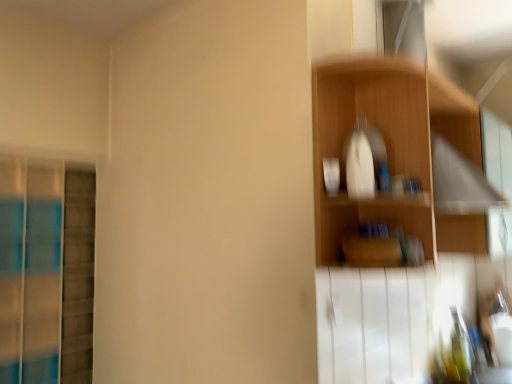
Describe the element at coordinates (391, 150) in the screenshot. I see `wooden shelf at upper right` at that location.

You are a GUI agent. You are given a task and a screenshot of the screen. Output one action in this format:
    pyautogui.click(x=<x>, y=<y>)
    Task: Click on the wooden shelf at upper right
    
    Given the screenshot: What is the action you would take?
    pyautogui.click(x=391, y=150)

In order to face wooden shelf at upper right, should I rotate leftwards or rightwards?

Turn right by 15.878 degrees to look at wooden shelf at upper right.

What is the approximate height of blue glass screen door at left?

It is 1.28 meters.

You are a GUI agent. You are given a task and a screenshot of the screen. Output one action in this format:
    pyautogui.click(x=<x>, y=<y>)
    Task: Click on the blue glass screen door at left
    The width and height of the screenshot is (512, 384).
    Given the screenshot: What is the action you would take?
    pyautogui.click(x=30, y=271)

Describe the element at coordinates (30, 271) in the screenshot. I see `blue glass screen door at left` at that location.

Where is `wooden shelf at upper right`? wooden shelf at upper right is located at coordinates (391, 150).

Which object is positioned more to the right, blue glass screen door at left or wooden shelf at upper right?

wooden shelf at upper right is more to the right.

Is blue glass screen door at left in front of wooden shelf at upper right?

No, it is behind wooden shelf at upper right.

Is point (51, 258) more distant than point (475, 246)?

Yes.

Looking at this image, from the image's perspective, is blue glass screen door at left located beneath wooden shelf at upper right?

Yes, from the image's perspective, blue glass screen door at left is beneath wooden shelf at upper right.

From a real-world perspective, is blue glass screen door at left physically located above or below wooden shelf at upper right?

In terms of real-world spatial position, blue glass screen door at left is below wooden shelf at upper right.

Considering the sizes of objects blue glass screen door at left and wooden shelf at upper right in the image provided, who is wider, blue glass screen door at left or wooden shelf at upper right?

wooden shelf at upper right is wider.

Which of these two, blue glass screen door at left or wooden shelf at upper right, stands shorter?

wooden shelf at upper right is shorter.

Is blue glass screen door at left bigger than wooden shelf at upper right?

Indeed, blue glass screen door at left has a larger size compared to wooden shelf at upper right.

Is blue glass screen door at left situated inside wooden shelf at upper right or outside?

blue glass screen door at left is spatially situated outside wooden shelf at upper right.

Is blue glass screen door at left not close to wooden shelf at upper right?

blue glass screen door at left is far away from wooden shelf at upper right.

Is blue glass screen door at left aimed at wooden shelf at upper right?

Yes, blue glass screen door at left is aimed at wooden shelf at upper right.

At what (x,y) coordinates should I click in order to perform the action: click on screen door on the left of the wooden shelf at upper right. Please return your answer as a coordinate pair (x, y). Looking at the image, I should click on (30, 271).

Visually, is wooden shelf at upper right positioned to the left or to the right of blue glass screen door at left?

Based on their positions, wooden shelf at upper right is located to the right of blue glass screen door at left.

Is the depth of wooden shelf at upper right greater than that of blue glass screen door at left?

No, it is not.

Is point (352, 110) in front of point (30, 367)?

Yes, point (352, 110) is closer to viewer.

In the scene shown: From the image's perspective, which is below, wooden shelf at upper right or blue glass screen door at left?

blue glass screen door at left appears lower in the image.

Looking at this image, from a real-world perspective, which object rests below the other?

blue glass screen door at left.

Which object is wider, wooden shelf at upper right or blue glass screen door at left?

Wider between the two is wooden shelf at upper right.

Can you confirm if wooden shelf at upper right is taller than blue glass screen door at left?

No, wooden shelf at upper right is not taller than blue glass screen door at left.

Looking at the image, does wooden shelf at upper right seem bigger or smaller compared to blue glass screen door at left?

In the image, wooden shelf at upper right appears to be smaller than blue glass screen door at left.

Based on the photo, would you say blue glass screen door at left is part of wooden shelf at upper right's contents?

No, wooden shelf at upper right does not contain blue glass screen door at left.

Is wooden shelf at upper right directly adjacent to blue glass screen door at left?

No, wooden shelf at upper right is not next to blue glass screen door at left.

From the picture: Is wooden shelf at upper right facing towards blue glass screen door at left?

No, wooden shelf at upper right is not oriented towards blue glass screen door at left.

Measure the distance from wooden shelf at upper right to blue glass screen door at left.

1.69 meters.

What are the coordinates of `screen door below the wooden shelf at upper right (from the image's perspective)` in the screenshot? It's located at click(30, 271).

What are the coordinates of `screen door lying on the left of wooden shelf at upper right` in the screenshot? It's located at (30, 271).

Where is `screen door below the wooden shelf at upper right (from a real-world perspective)`? Image resolution: width=512 pixels, height=384 pixels. screen door below the wooden shelf at upper right (from a real-world perspective) is located at coordinates (30, 271).